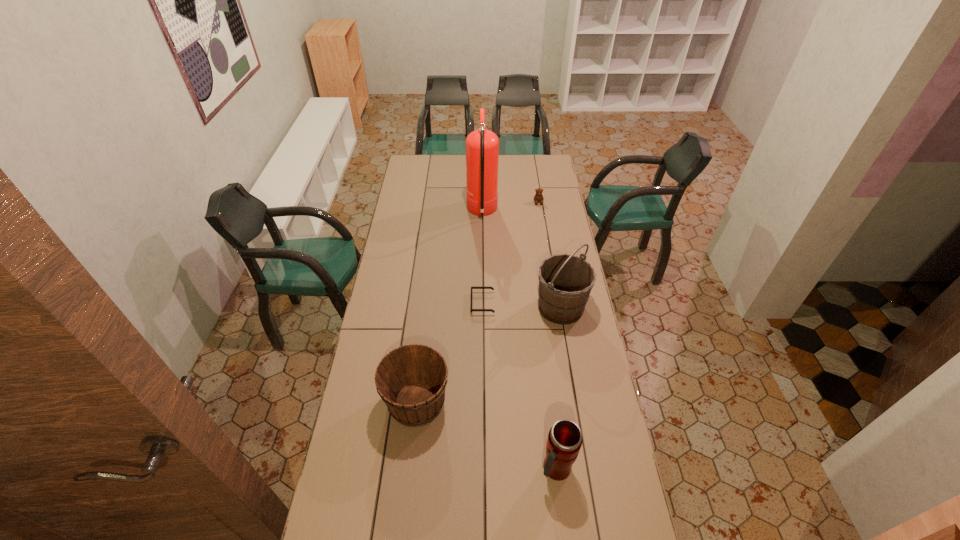
What are the coordinates of `thermos bottle that is at the right edge` in the screenshot? It's located at (564, 441).

This screenshot has height=540, width=960. In order to click on teddy bear that is positioned at the right edge in this screenshot , I will do `click(538, 197)`.

The image size is (960, 540). I want to click on vacant space at the far edge, so click(520, 163).

Locate an element on the screen. The height and width of the screenshot is (540, 960). vacant space at the left edge of the desktop is located at coordinates (393, 293).

Locate an element on the screen. vacant point at the right edge is located at coordinates (586, 394).

The width and height of the screenshot is (960, 540). What are the coordinates of `free spot between the fifth tallest object and the sunglasses` in the screenshot? It's located at (511, 253).

This screenshot has height=540, width=960. I want to click on unoccupied position between the nearest object and the sunglasses, so click(519, 386).

This screenshot has width=960, height=540. Identify the location of vacant area between the wine bucket and the thermos bottle. (487, 436).

Image resolution: width=960 pixels, height=540 pixels. Find the location of `unoccupied position between the teddy bear and the sunglasses`. unoccupied position between the teddy bear and the sunglasses is located at coordinates (511, 253).

You are a GUI agent. You are given a task and a screenshot of the screen. Output one action in this format:
    pyautogui.click(x=<x>, y=<y>)
    Task: Click on the empty location between the fifth farthest object and the teddy bear
    
    Given the screenshot: What is the action you would take?
    pyautogui.click(x=477, y=302)